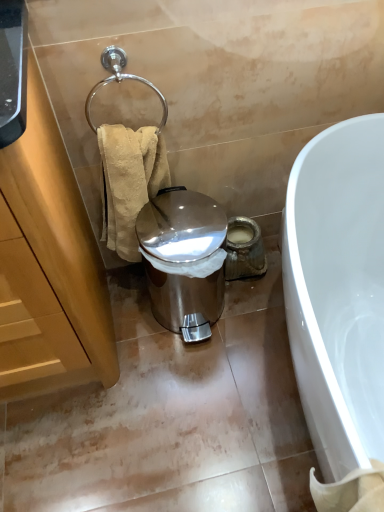
Question: Can you confirm if shiny metallic trash can at center is wider than polished chrome towel ring at upper left?

Choices:
 (A) no
 (B) yes

Answer: (B)

Question: Does shiny metallic trash can at center have a greater height compared to polished chrome towel ring at upper left?

Choices:
 (A) no
 (B) yes

Answer: (B)

Question: Is shiny metallic trash can at center aimed at polished chrome towel ring at upper left?

Choices:
 (A) yes
 (B) no

Answer: (B)

Question: Considering the relative sizes of shiny metallic trash can at center and polished chrome towel ring at upper left in the image provided, is shiny metallic trash can at center shorter than polished chrome towel ring at upper left?

Choices:
 (A) yes
 (B) no

Answer: (B)

Question: Considering the relative sizes of shiny metallic trash can at center and polished chrome towel ring at upper left in the image provided, is shiny metallic trash can at center thinner than polished chrome towel ring at upper left?

Choices:
 (A) yes
 (B) no

Answer: (B)

Question: Is shiny metallic trash can at center completely or partially outside of polished chrome towel ring at upper left?

Choices:
 (A) no
 (B) yes

Answer: (B)

Question: From a real-world perspective, does polished chrome towel ring at upper left stand above wooden cabinet at left?

Choices:
 (A) no
 (B) yes

Answer: (B)

Question: Is polished chrome towel ring at upper left behind wooden cabinet at left?

Choices:
 (A) yes
 (B) no

Answer: (A)

Question: From a real-world perspective, is polished chrome towel ring at upper left physically below wooden cabinet at left?

Choices:
 (A) no
 (B) yes

Answer: (A)

Question: From the image's perspective, is polished chrome towel ring at upper left beneath wooden cabinet at left?

Choices:
 (A) yes
 (B) no

Answer: (B)

Question: Is polished chrome towel ring at upper left positioned beyond the bounds of wooden cabinet at left?

Choices:
 (A) yes
 (B) no

Answer: (A)

Question: Considering the relative sizes of polished chrome towel ring at upper left and wooden cabinet at left in the image provided, is polished chrome towel ring at upper left shorter than wooden cabinet at left?

Choices:
 (A) no
 (B) yes

Answer: (B)

Question: Does beige textured towel at left lie behind shiny metallic trash can at center?

Choices:
 (A) no
 (B) yes

Answer: (A)